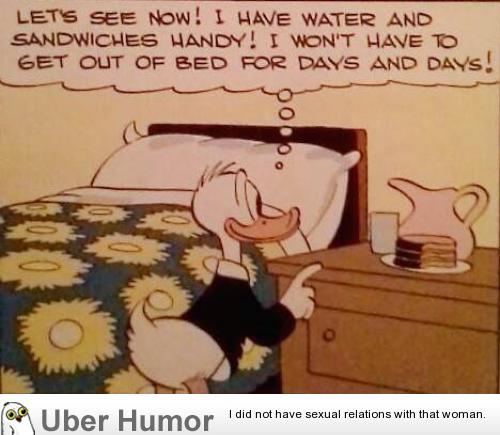
Locate an element on the screen. This screenshot has width=500, height=435. pitcher is located at coordinates (417, 203).